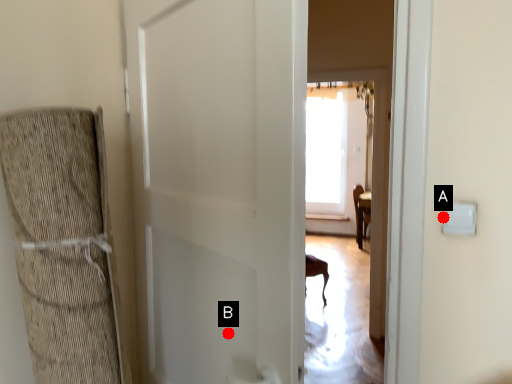
Question: Two points are circled on the image, labeled by A and B beside each circle. Which point is closer to the camera?

Choices:
 (A) A is closer
 (B) B is closer

Answer: (B)